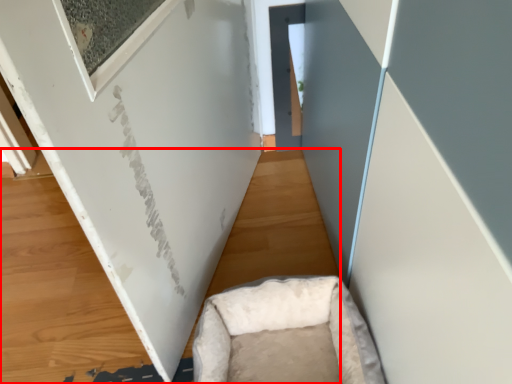
Question: From the image's perspective, what is the correct spatial relationship of plywood (annotated by the red box) in relation to furniture?

Choices:
 (A) above
 (B) below

Answer: (A)